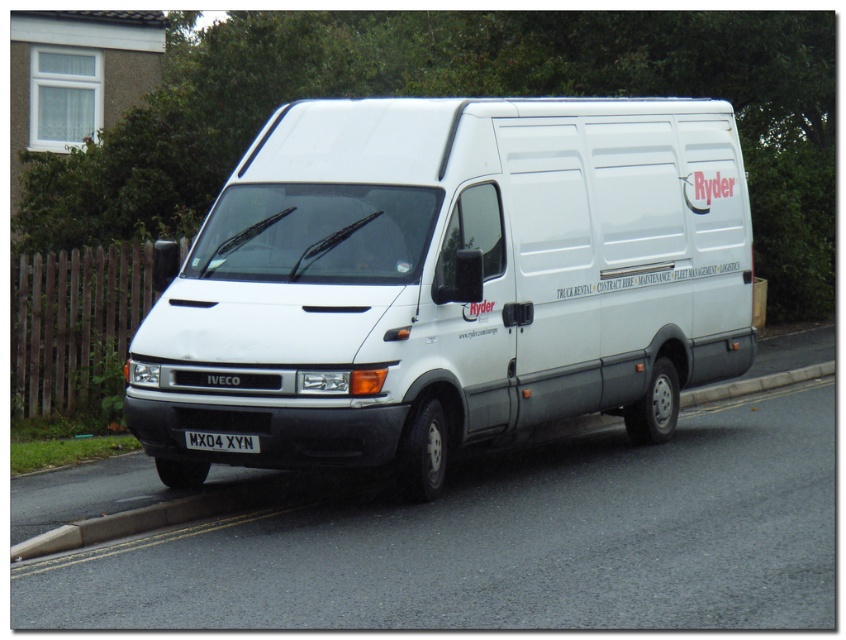
Does white matte van at center appear under concrete curb at lower center?

Incorrect, white matte van at center is not positioned below concrete curb at lower center.

Which is in front, point (547, 371) or point (283, 483)?

Point (283, 483) is more forward.

Who is more forward, [608,180] or [805,380]?

Point [608,180]

Locate an element on the screen. white matte van at center is located at coordinates (449, 282).

Is concrete curb at lower center above white plastic license plate at center?

No, concrete curb at lower center is not above white plastic license plate at center.

Describe the element at coordinates (165, 513) in the screenshot. I see `concrete curb at lower center` at that location.

Locate an element on the screen. concrete curb at lower center is located at coordinates (165, 513).

Which is more to the left, white matte van at center or white plastic license plate at center?

white plastic license plate at center

Which of these two, white matte van at center or white plastic license plate at center, stands taller?

white matte van at center

What do you see at coordinates (449, 282) in the screenshot?
I see `white matte van at center` at bounding box center [449, 282].

Locate an element on the screen. This screenshot has width=846, height=640. white matte van at center is located at coordinates (449, 282).